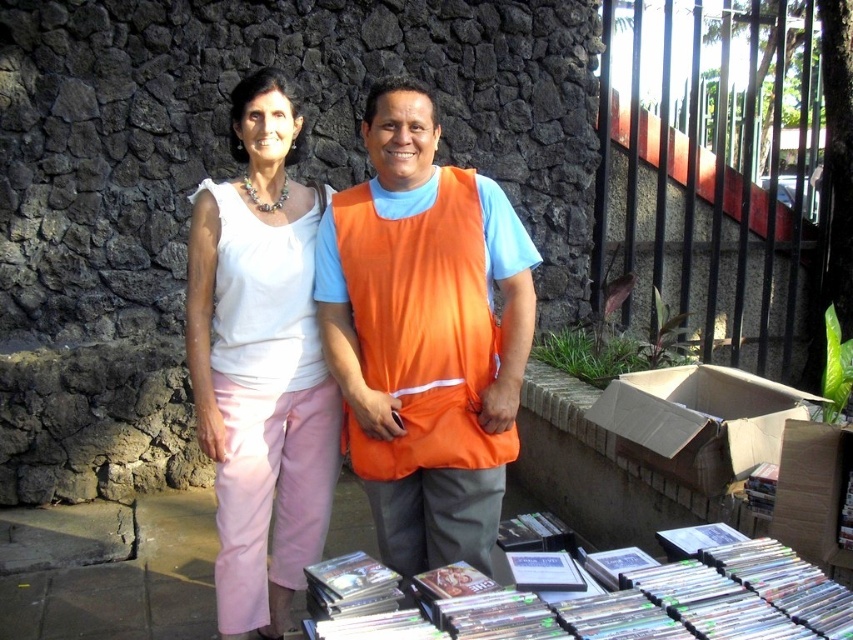
Is point (720, 637) closer to viewer compared to point (784, 416)?

Yes.

Is point (775, 636) more distant than point (669, 372)?

No, it is in front of (669, 372).

I want to click on clear plastic dvds at lower center, so click(x=628, y=604).

Based on the photo, can you confirm if orange fabric vest at center is positioned to the left of cardboard box at lower right?

Correct, you'll find orange fabric vest at center to the left of cardboard box at lower right.

Is point (386, 118) farther from camera compared to point (813, 400)?

No, (386, 118) is closer to viewer.

Locate an element on the screen. Image resolution: width=853 pixels, height=640 pixels. orange fabric vest at center is located at coordinates (424, 336).

Is orange fabric vest at center bigger than clear plastic dvds at lower center?

Yes, orange fabric vest at center is bigger than clear plastic dvds at lower center.

This screenshot has height=640, width=853. Identify the location of orange fabric vest at center. (424, 336).

The image size is (853, 640). I want to click on orange fabric vest at center, so click(x=424, y=336).